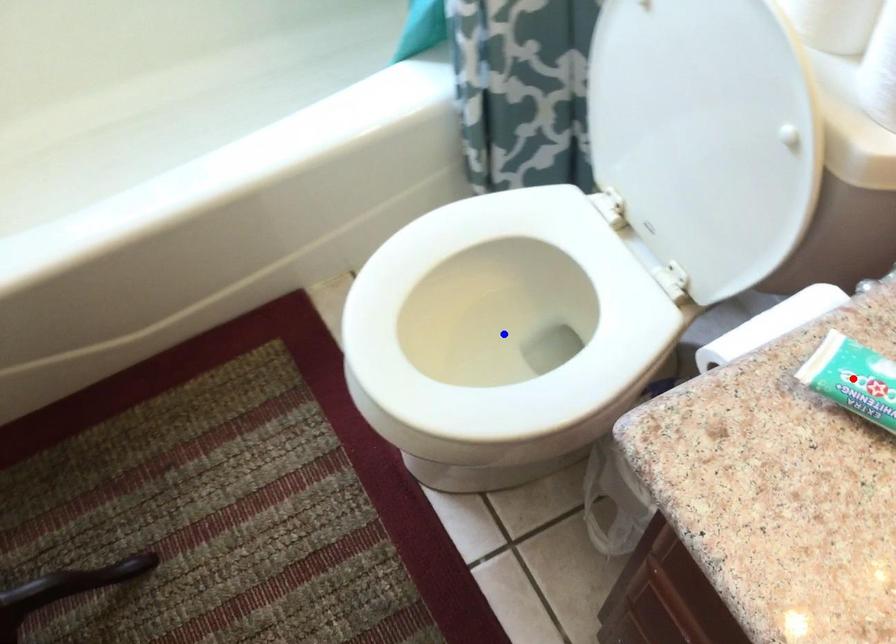
Question: Which of the two points in the image is closer to the camera?

Choices:
 (A) Blue point is closer.
 (B) Red point is closer.

Answer: (B)